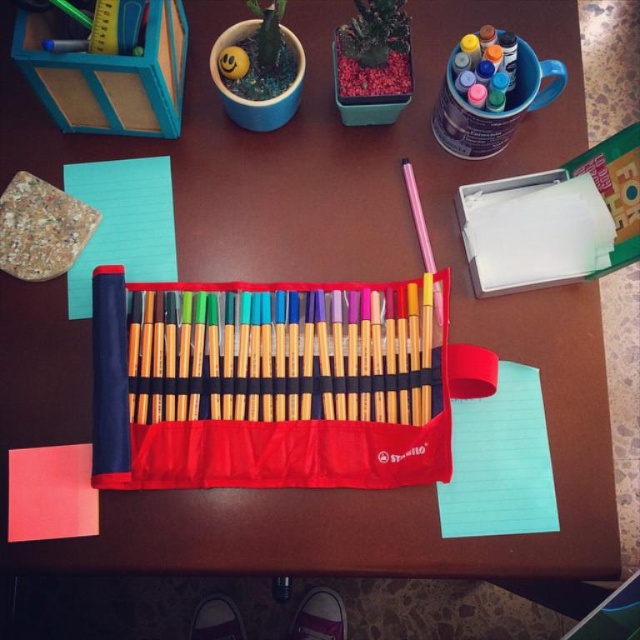
Question: Which point appears farthest from the camera in this image?

Choices:
 (A) (163, 304)
 (B) (38, 515)
 (C) (172, 243)
 (D) (440, 529)

Answer: (C)

Question: Observing the image, what is the correct spatial positioning of matte fabric pencil case at center in reference to light blue paper at center?

Choices:
 (A) left
 (B) right

Answer: (B)

Question: Which of the following is the closest to the observer?

Choices:
 (A) (532, 401)
 (B) (108, 336)
 (C) (26, 538)
 (D) (97, 182)

Answer: (B)

Question: Can you confirm if light blue paper at lower right is positioned above light blue paper at center?

Choices:
 (A) yes
 (B) no

Answer: (B)

Question: Which object is the farthest from the matte fabric pencil case at center?

Choices:
 (A) red matte notepad at lower left
 (B) light blue paper at lower right

Answer: (A)

Question: Is matte fabric pencil case at center further to camera compared to light blue paper at center?

Choices:
 (A) yes
 (B) no

Answer: (B)